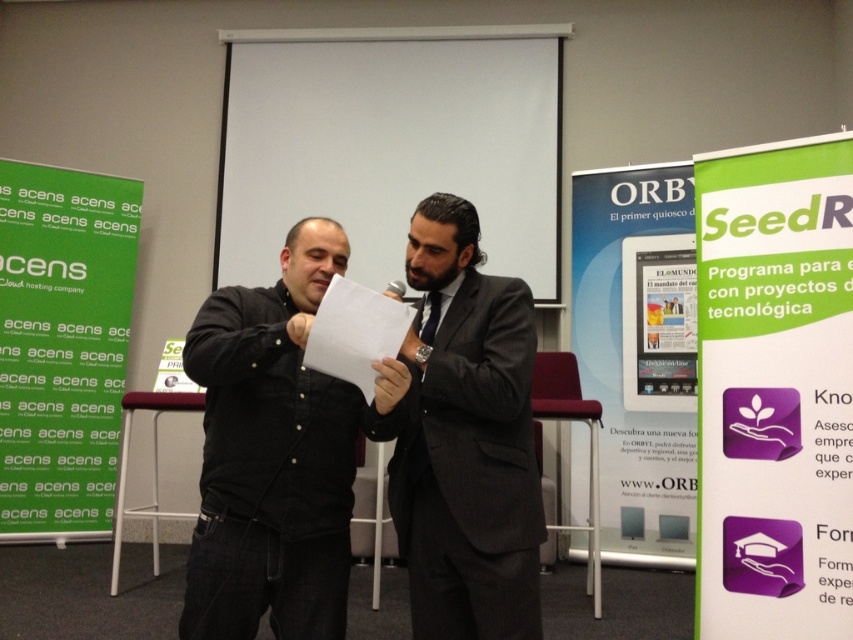
Is dark gray suit at center to the right of white paper at center from the viewer's perspective?

→ Correct, you'll find dark gray suit at center to the right of white paper at center.

Is point (405, 346) in front of point (341, 278)?

That is False.

Measure the distance between point (x=512, y=490) and camera.

Point (x=512, y=490) and camera are 1.83 meters apart.

This screenshot has width=853, height=640. Find the location of `dark gray suit at center`. dark gray suit at center is located at coordinates (467, 442).

Identify the location of blue glossy poster at center. This screenshot has height=640, width=853. (639, 353).

Between blue glossy poster at center and white paper at center, which one appears on the right side from the viewer's perspective?

Positioned to the right is blue glossy poster at center.

Locate an element on the screen. blue glossy poster at center is located at coordinates (639, 353).

Find the location of a particular element. The height and width of the screenshot is (640, 853). blue glossy poster at center is located at coordinates (639, 353).

Which is in front, point (653, 243) or point (422, 323)?

Positioned in front is point (422, 323).

Between white glossy tablet at center and silky black tie at center, which one appears on the left side from the viewer's perspective?

Positioned to the left is silky black tie at center.

Describe the element at coordinates (659, 323) in the screenshot. Image resolution: width=853 pixels, height=640 pixels. I see `white glossy tablet at center` at that location.

Locate an element on the screen. white glossy tablet at center is located at coordinates (659, 323).